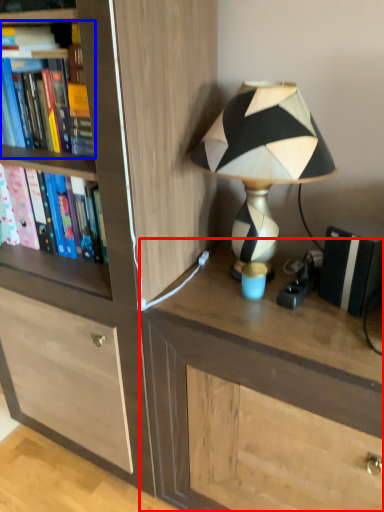
Question: Among these objects, which one is nearest to the camera, desk (highlighted by a red box) or book (highlighted by a blue box)?

Choices:
 (A) desk
 (B) book

Answer: (A)